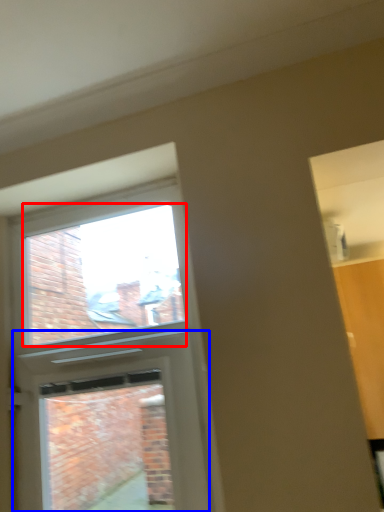
Question: Which object appears closest to the camera in this image, window screen (highlighted by a red box) or screen door (highlighted by a blue box)?

Choices:
 (A) window screen
 (B) screen door

Answer: (B)